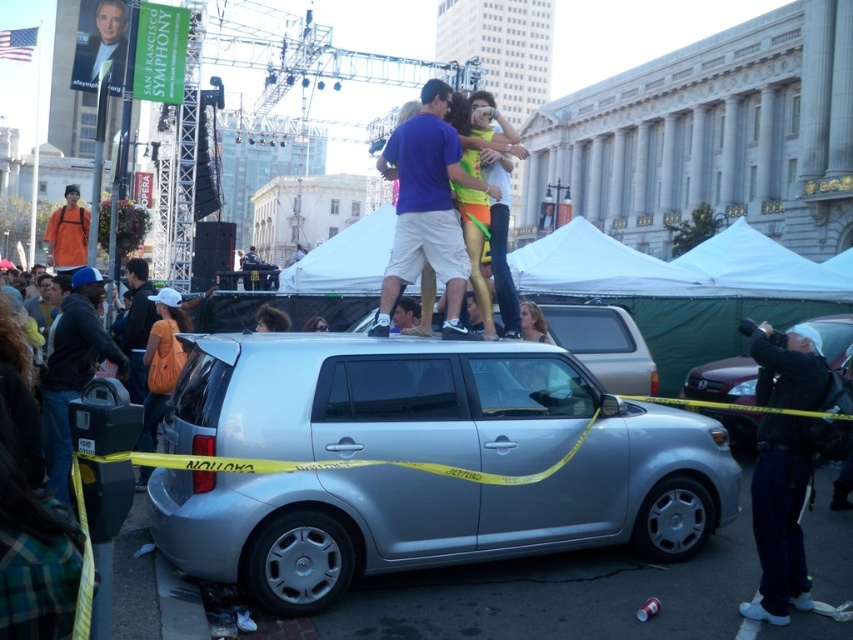
Does dark blue jacket at left appear on the right side of orange fabric shirt at left?

Yes, dark blue jacket at left is to the right of orange fabric shirt at left.

Is dark blue jacket at left thinner than orange fabric shirt at left?

Correct, dark blue jacket at left's width is less than orange fabric shirt at left's.

Does point (61, 438) come farther from viewer compared to point (77, 195)?

No, (61, 438) is closer to viewer.

Where is `dark blue jacket at left`? dark blue jacket at left is located at coordinates (73, 371).

The image size is (853, 640). Describe the element at coordinates (426, 202) in the screenshot. I see `matte blue shirt at center` at that location.

Does matte blue shirt at center lie in front of dark blue jacket at left?

That is False.

Between point (445, 150) and point (61, 413), which one is positioned behind?

The point (445, 150) is more distant.

This screenshot has width=853, height=640. Find the location of `matte blue shirt at center`. matte blue shirt at center is located at coordinates (426, 202).

Between silver metallic hatchback at center and orange fabric shirt at left, which one is positioned higher?

Positioned higher is orange fabric shirt at left.

Is point (735, 369) positioned after point (64, 240)?

That is False.

Locate an element on the screen. This screenshot has width=853, height=640. silver metallic hatchback at center is located at coordinates (723, 380).